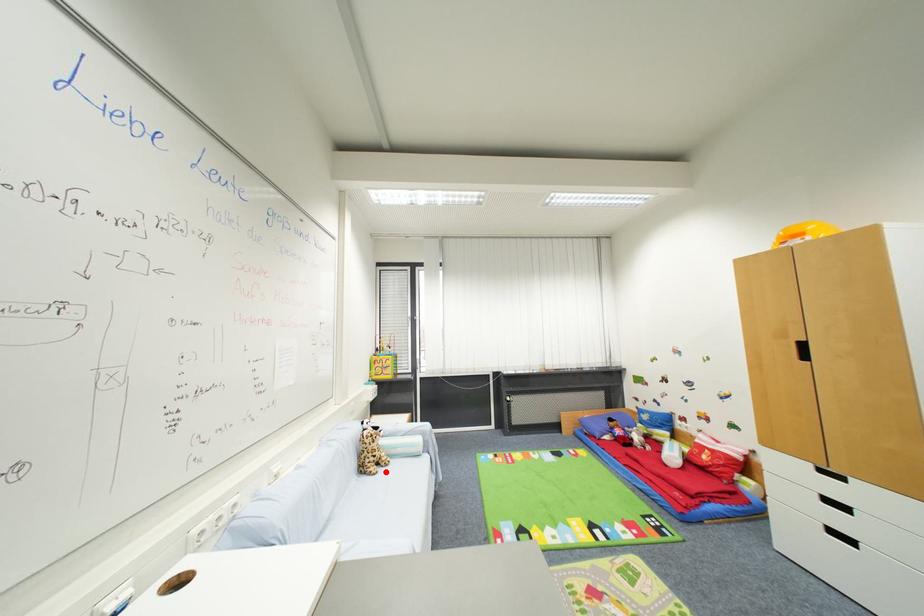
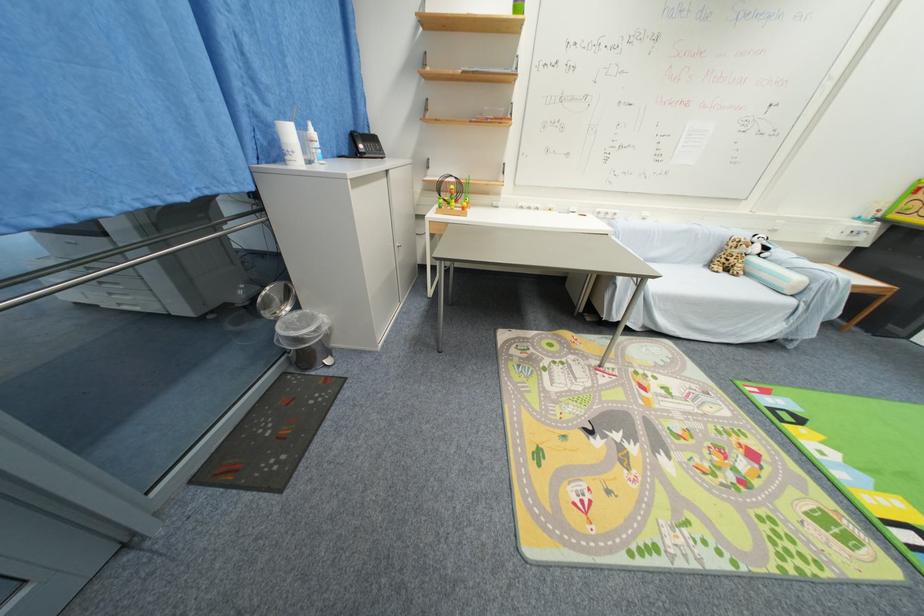
In the second image, find the point that corresponds to the highlighted location in the first image.

(730, 276)